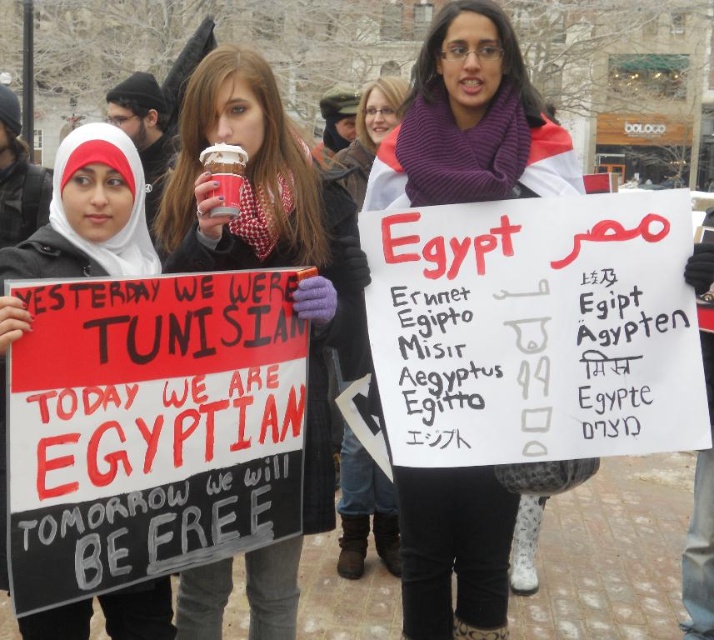
Question: Is purple knitted scarf at center to the right of matte red cup at center from the viewer's perspective?

Choices:
 (A) yes
 (B) no

Answer: (A)

Question: Which of the following is the farthest from the observer?

Choices:
 (A) white fabric hijab at upper left
 (B) purple scarf at center

Answer: (B)

Question: Where is purple knitted scarf at center located in relation to white fabric hijab at upper left in the image?

Choices:
 (A) left
 (B) right

Answer: (B)

Question: Which object is the farthest from the white fabric hijab at upper left?

Choices:
 (A) matte red cup at center
 (B) purple knitted scarf at center

Answer: (B)

Question: Among these objects, which one is farthest from the camera?

Choices:
 (A) purple scarf at center
 (B) matte red cup at center

Answer: (A)

Question: Can you confirm if matte red cup at center is wider than purple scarf at center?

Choices:
 (A) yes
 (B) no

Answer: (A)